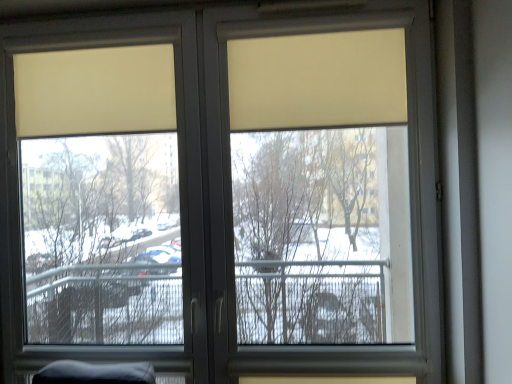
Question: Does beige matte curtain at upper center, the 1th curtain viewed from the right, have a greater width compared to matte plastic window screen at center?

Choices:
 (A) no
 (B) yes

Answer: (A)

Question: Is beige matte curtain at upper center, the 1th curtain viewed from the right, shorter than matte plastic window screen at center?

Choices:
 (A) no
 (B) yes

Answer: (B)

Question: Does beige matte curtain at upper center, which is the 2th curtain in left-to-right order, lie behind matte plastic window screen at center?

Choices:
 (A) no
 (B) yes

Answer: (A)

Question: From a real-world perspective, is beige matte curtain at upper center, the 1th curtain viewed from the right, physically below matte plastic window screen at center?

Choices:
 (A) no
 (B) yes

Answer: (A)

Question: Is beige matte curtain at upper center, which is the 2th curtain in left-to-right order, taller than matte plastic window screen at center?

Choices:
 (A) no
 (B) yes

Answer: (A)

Question: Does beige matte curtain at upper center, which is the 2th curtain in left-to-right order, have a larger size compared to matte plastic window screen at center?

Choices:
 (A) yes
 (B) no

Answer: (B)

Question: From a real-world perspective, is beige matte curtain at upper left, the first curtain positioned from the left, located higher than beige matte curtain at upper center, the 1th curtain viewed from the right?

Choices:
 (A) no
 (B) yes

Answer: (B)

Question: Considering the relative sizes of beige matte curtain at upper left, the second curtain viewed from the right, and beige matte curtain at upper center, the 1th curtain viewed from the right, in the image provided, is beige matte curtain at upper left, the second curtain viewed from the right, thinner than beige matte curtain at upper center, the 1th curtain viewed from the right,?

Choices:
 (A) no
 (B) yes

Answer: (B)

Question: Can you confirm if beige matte curtain at upper left, the second curtain viewed from the right, is smaller than beige matte curtain at upper center, the 1th curtain viewed from the right?

Choices:
 (A) yes
 (B) no

Answer: (A)

Question: From the image's perspective, is beige matte curtain at upper left, the first curtain positioned from the left, under beige matte curtain at upper center, the 1th curtain viewed from the right?

Choices:
 (A) yes
 (B) no

Answer: (A)

Question: Does beige matte curtain at upper left, the second curtain viewed from the right, come in front of beige matte curtain at upper center, the 1th curtain viewed from the right?

Choices:
 (A) yes
 (B) no

Answer: (B)

Question: Is beige matte curtain at upper left, the first curtain positioned from the left, oriented towards beige matte curtain at upper center, the 1th curtain viewed from the right?

Choices:
 (A) yes
 (B) no

Answer: (B)

Question: Is matte plastic window screen at center far from beige matte curtain at upper center, the 1th curtain viewed from the right?

Choices:
 (A) no
 (B) yes

Answer: (B)